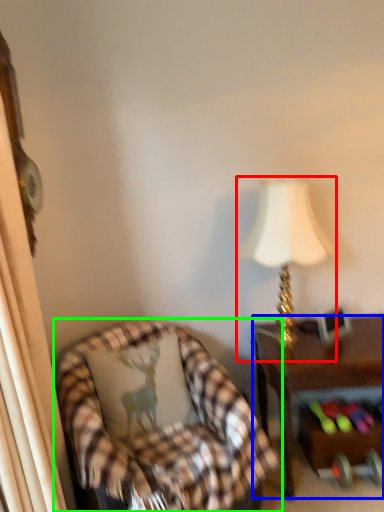
Question: Which object is the closest to the lamp (highlighted by a red box)? Choose among these: desk (highlighted by a blue box) or chair (highlighted by a green box).

Choices:
 (A) desk
 (B) chair

Answer: (A)